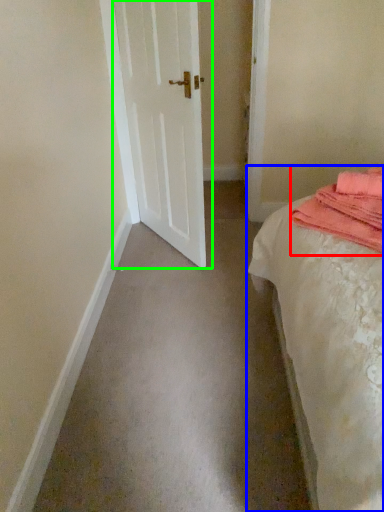
Question: Estimate the real-world distances between objects in this image. Which object is closer to material (highlighted by a red box), bed (highlighted by a blue box) or door (highlighted by a green box)?

Choices:
 (A) bed
 (B) door

Answer: (A)